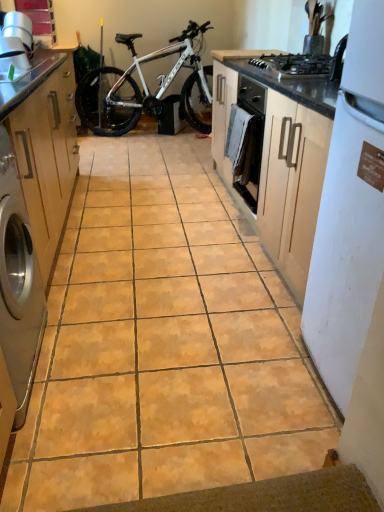
Where is `vacant area that is situated to the right of satin silver washing machine at left`? vacant area that is situated to the right of satin silver washing machine at left is located at coordinates (107, 368).